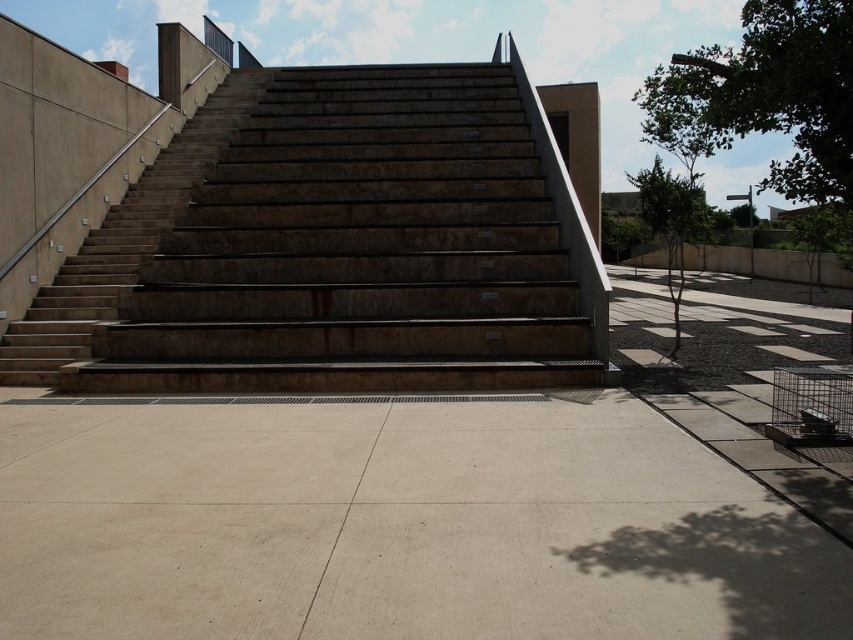
Does beige concrete pavement at center come in front of brown stone stairs at center?

Yes, it is in front of brown stone stairs at center.

In the scene shown: Does beige concrete pavement at center appear under brown stone stairs at center?

Yes.

Is point (383, 577) behind point (329, 316)?

No.

This screenshot has height=640, width=853. I want to click on beige concrete pavement at center, so click(397, 525).